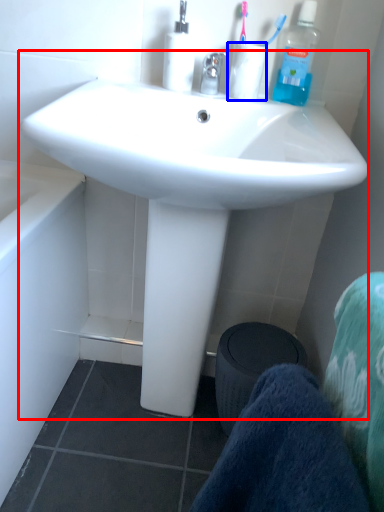
Question: Which object is closer to the camera taking this photo, sink (highlighted by a red box) or coffee cup (highlighted by a blue box)?

Choices:
 (A) sink
 (B) coffee cup

Answer: (A)